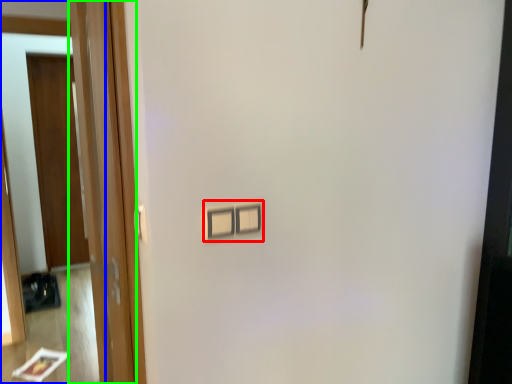
Question: Considering the real-world distances, which object is closest to light switch (highlighted by a red box)? mirror (highlighted by a blue box) or door (highlighted by a green box).

Choices:
 (A) mirror
 (B) door

Answer: (B)